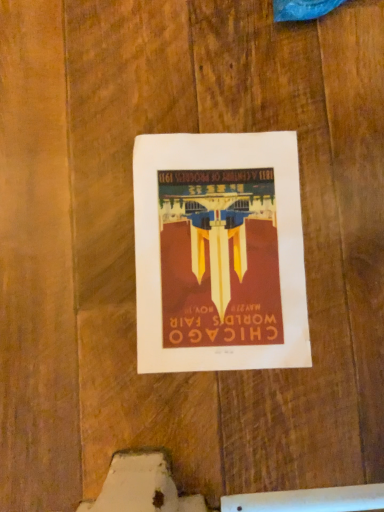
What is the approximate height of matte paper poster at center?

The height of matte paper poster at center is 1.06 centimeters.

At what (x,y) coordinates should I click in order to perform the action: click on matte paper poster at center. Please return your answer as a coordinate pair (x, y). Looking at the image, I should click on (219, 253).

What do you see at coordinates (219, 253) in the screenshot?
I see `matte paper poster at center` at bounding box center [219, 253].

I want to click on matte paper poster at center, so click(x=219, y=253).